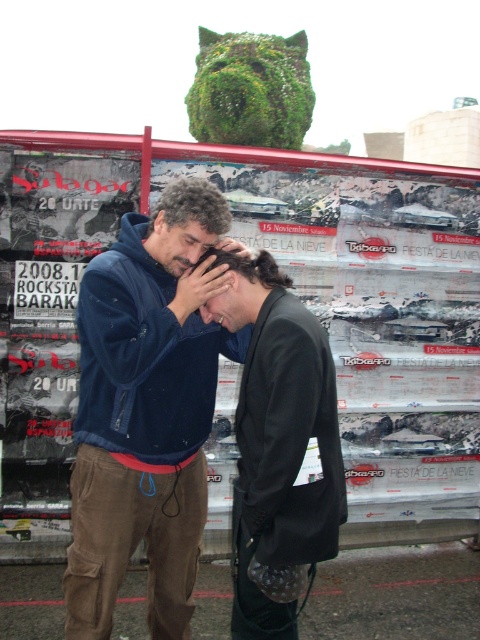
Question: Does matte blue jacket at center appear under matte black hair at center?

Choices:
 (A) yes
 (B) no

Answer: (B)

Question: Can you confirm if dark blue fleece at center is thinner than matte blue jacket at center?

Choices:
 (A) no
 (B) yes

Answer: (A)

Question: Which point is closer to the camera taking this photo?

Choices:
 (A) (x=83, y=333)
 (B) (x=183, y=268)

Answer: (A)

Question: Which point is farther to the camera?

Choices:
 (A) dark blue fleece at center
 (B) white paper posters at center
 (C) matte black hair at center
 (D) matte blue jacket at center

Answer: (B)

Question: Is black matte jacket at center closer to the viewer compared to matte blue jacket at center?

Choices:
 (A) yes
 (B) no

Answer: (A)

Question: Among these objects, which one is farthest from the camera?

Choices:
 (A) white paper posters at center
 (B) matte blue jacket at center

Answer: (A)